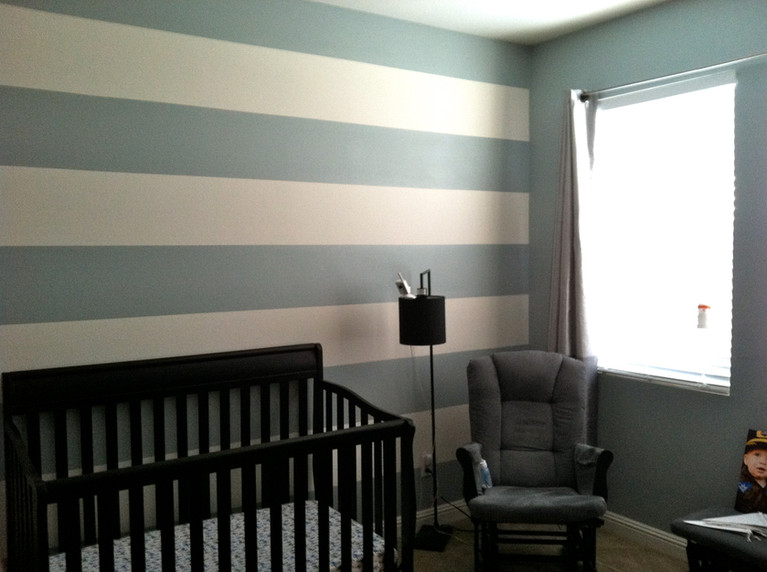
This screenshot has height=572, width=767. What are the coordinates of `white ceiling` in the screenshot? It's located at (542, 10).